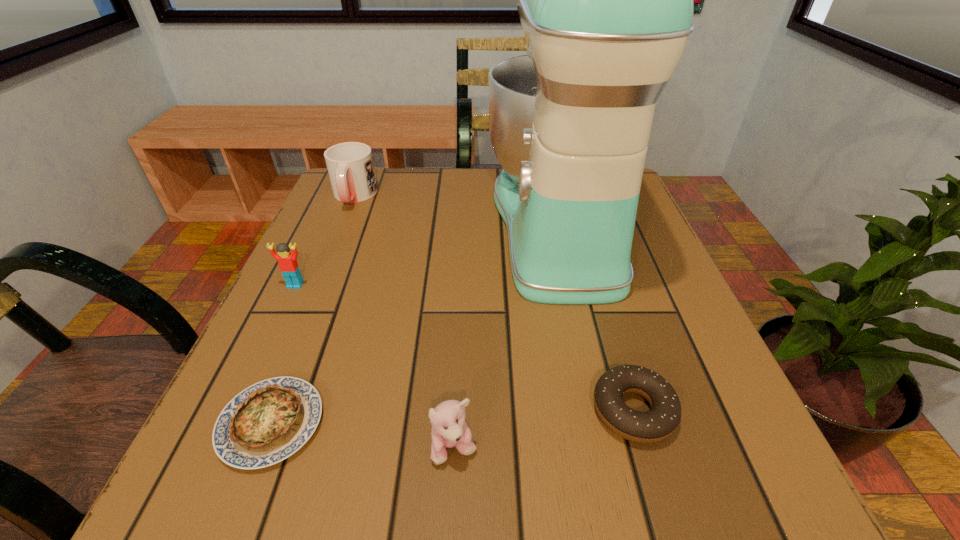
Find the location of a particular element. This screenshot has height=540, width=960. vacant space at the far left corner is located at coordinates (388, 180).

In the image, there is a desktop. Find the location of `vacant area at the near left corner`. vacant area at the near left corner is located at coordinates (187, 518).

Locate an element on the screen. The height and width of the screenshot is (540, 960). empty space between the mug and the fourth object from left to right is located at coordinates (404, 322).

At what (x,y) coordinates should I click in order to perform the action: click on free point between the tallest object and the third object from right to left. Please return your answer as a coordinate pair (x, y). The height and width of the screenshot is (540, 960). Looking at the image, I should click on (506, 336).

This screenshot has height=540, width=960. I want to click on free space that is in between the teddy bear and the second shortest object, so click(x=543, y=429).

At what (x,y) coordinates should I click in order to perform the action: click on free space that is in between the mug and the tallest object. Please return your answer as a coordinate pair (x, y). Looking at the image, I should click on (456, 211).

Find the location of a particular element. The height and width of the screenshot is (540, 960). free space between the tallest object and the doughnut is located at coordinates (595, 318).

Locate an element on the screen. This screenshot has width=960, height=540. free spot between the teddy bear and the tallest object is located at coordinates (506, 336).

This screenshot has width=960, height=540. I want to click on free space that is in between the mug and the Lego, so click(324, 240).

Locate an element on the screen. The width and height of the screenshot is (960, 540). free space that is in between the mixer and the mug is located at coordinates (456, 211).